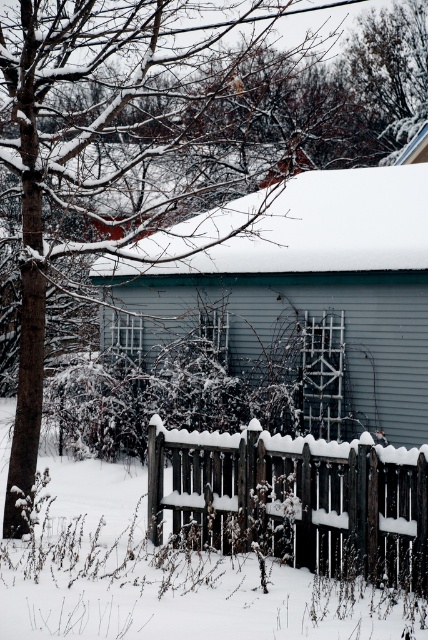
Question: Does smooth gray siding at center appear under snow-covered wooden fence at center?

Choices:
 (A) yes
 (B) no

Answer: (B)

Question: Which point is farther to the camera?

Choices:
 (A) snow-covered wooden fence at center
 (B) smooth gray siding at center

Answer: (B)

Question: Is smooth gray siding at center thinner than snow-covered wooden fence at center?

Choices:
 (A) yes
 (B) no

Answer: (A)

Question: Can you confirm if smooth gray siding at center is thinner than snow-covered wooden fence at center?

Choices:
 (A) yes
 (B) no

Answer: (A)